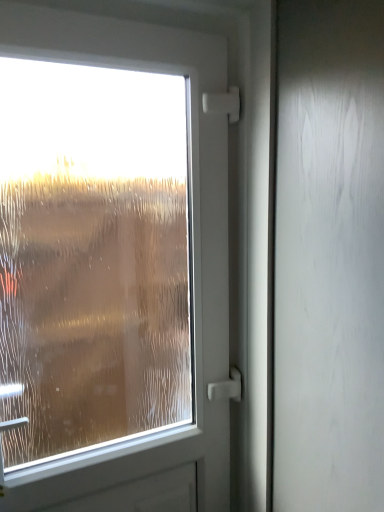
Question: Considering the positions of point (311, 143) and point (51, 69), is point (311, 143) closer or farther from the camera than point (51, 69)?

Choices:
 (A) closer
 (B) farther

Answer: (A)

Question: From the image's perspective, is satin white screen door at right above or below frosted glass window at left?

Choices:
 (A) below
 (B) above

Answer: (B)

Question: From a real-world perspective, relative to frosted glass window at left, is satin white screen door at right vertically above or below?

Choices:
 (A) below
 (B) above

Answer: (B)

Question: Do you think frosted glass window at left is within satin white screen door at right, or outside of it?

Choices:
 (A) outside
 (B) inside

Answer: (A)

Question: From the image's perspective, is frosted glass window at left above or below satin white screen door at right?

Choices:
 (A) above
 (B) below

Answer: (B)

Question: From a real-world perspective, is frosted glass window at left positioned above or below satin white screen door at right?

Choices:
 (A) below
 (B) above

Answer: (A)

Question: Based on their positions, is frosted glass window at left located to the left or right of satin white screen door at right?

Choices:
 (A) right
 (B) left

Answer: (B)